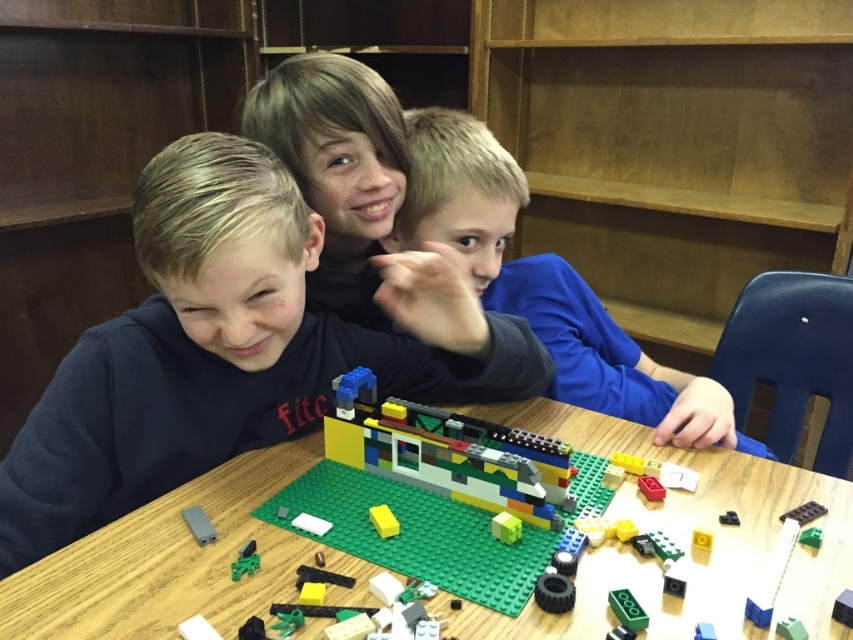
Between point (498, 392) and point (721, 524), which one is positioned behind?

Positioned behind is point (498, 392).

Find the location of `dark blue sweatshirt at left`. dark blue sweatshirt at left is located at coordinates (233, 348).

Does matte gray plastic piece at center appear under yellow matte square at center?

Incorrect, matte gray plastic piece at center is not positioned below yellow matte square at center.

Which of these two, matte gray plastic piece at center or yellow matte square at center, stands shorter?

Standing shorter between the two is yellow matte square at center.

This screenshot has height=640, width=853. Identify the location of matte gray plastic piece at center. (198, 524).

The height and width of the screenshot is (640, 853). I want to click on matte gray plastic piece at center, so click(x=198, y=524).

Does point (207, 420) come behind point (708, 538)?

Yes, point (207, 420) is behind point (708, 538).

Is dark blue sweatshirt at left to the right of yellow matte square at center from the viewer's perspective?

No, dark blue sweatshirt at left is not to the right of yellow matte square at center.

Is point (258, 272) positioned before point (711, 536)?

Yes, point (258, 272) is in front of point (711, 536).

Identify the location of dark blue sweatshirt at left. (233, 348).